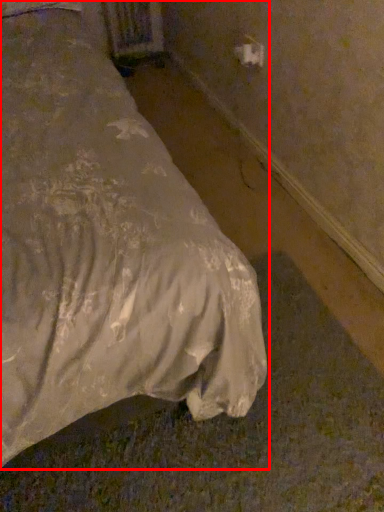
Question: From the image's perspective, where is bed (annotated by the red box) located relative to electric outlet?

Choices:
 (A) below
 (B) above

Answer: (A)